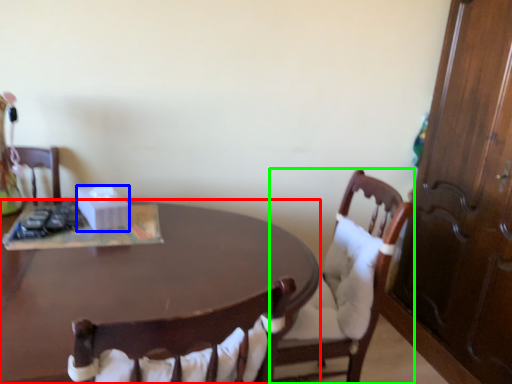
Question: Considering the real-world distances, which object is closest to desk (highlighted by a red box)? box (highlighted by a blue box) or chair (highlighted by a green box).

Choices:
 (A) box
 (B) chair

Answer: (A)